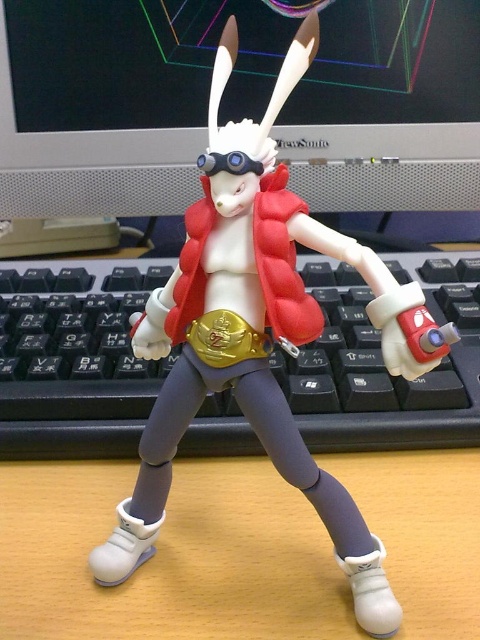
Can you confirm if black plastic keyboard at center is thinner than blue matte goggles at center?

Incorrect, black plastic keyboard at center's width is not less than blue matte goggles at center's.

Does point (26, 304) come closer to viewer compared to point (225, 157)?

No, it is not.

The height and width of the screenshot is (640, 480). In order to click on black plastic keyboard at center in this screenshot , I will do `click(74, 356)`.

Between matte red jacket at center and black plastic keyboard at center, which one is positioned lower?

Positioned lower is matte red jacket at center.

Is point (204, 396) closer to camera compared to point (467, 435)?

Yes, point (204, 396) is closer to viewer.

Locate an element on the screen. The image size is (480, 640). matte red jacket at center is located at coordinates (260, 337).

Who is positioned more to the right, matte black monitor at upper center or matte red jacket at center?

matte red jacket at center

Image resolution: width=480 pixels, height=640 pixels. I want to click on matte black monitor at upper center, so click(x=120, y=99).

This screenshot has width=480, height=640. Describe the element at coordinates (120, 99) in the screenshot. I see `matte black monitor at upper center` at that location.

The width and height of the screenshot is (480, 640). Identify the location of matte black monitor at upper center. (120, 99).